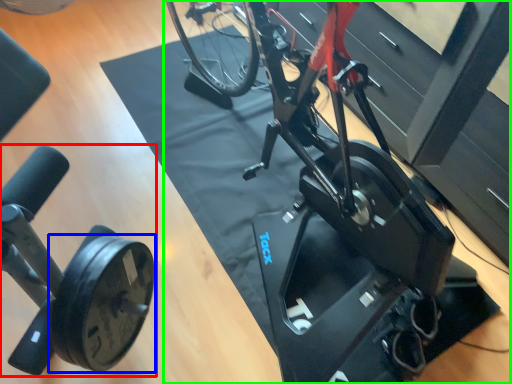
Question: Estimate the real-world distances between objects in this image. Which object is farther from stationary bicycle (highlighted by a red box), wheel (highlighted by a blue box) or stationary bicycle (highlighted by a green box)?

Choices:
 (A) wheel
 (B) stationary bicycle

Answer: (B)